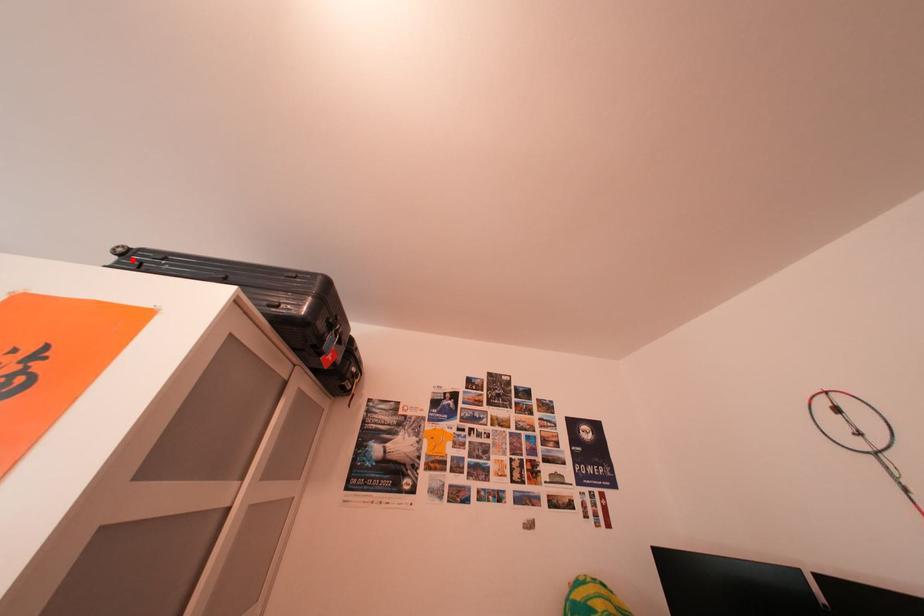
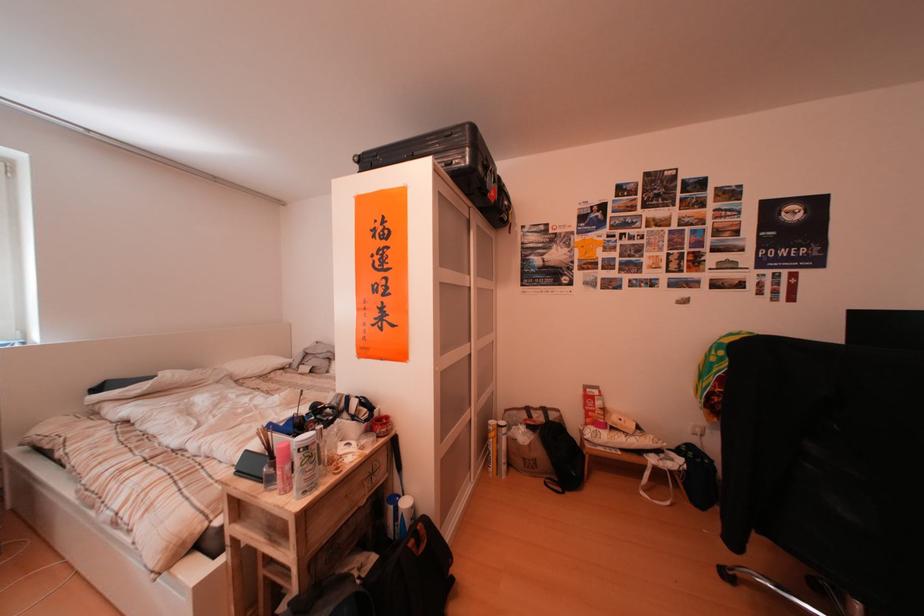
Locate, in the second image, the point that corresponds to the highlighted location in the first image.

(371, 167)